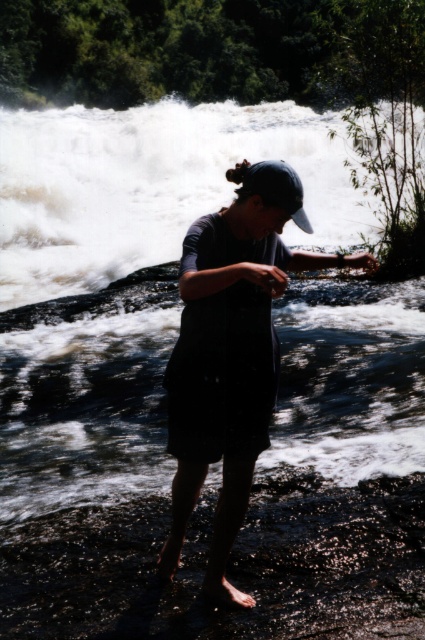
Question: Can you confirm if dark blue fabric shirt at center is positioned to the right of black matte baseball cap at center?

Choices:
 (A) no
 (B) yes

Answer: (A)

Question: Which point is closer to the camera?

Choices:
 (A) (251, 177)
 (B) (294, 195)

Answer: (B)

Question: Can you confirm if dark blue fabric shirt at center is positioned below black matte baseball cap at center?

Choices:
 (A) no
 (B) yes

Answer: (B)

Question: Can you confirm if dark blue fabric shirt at center is smaller than black matte baseball cap at center?

Choices:
 (A) yes
 (B) no

Answer: (B)